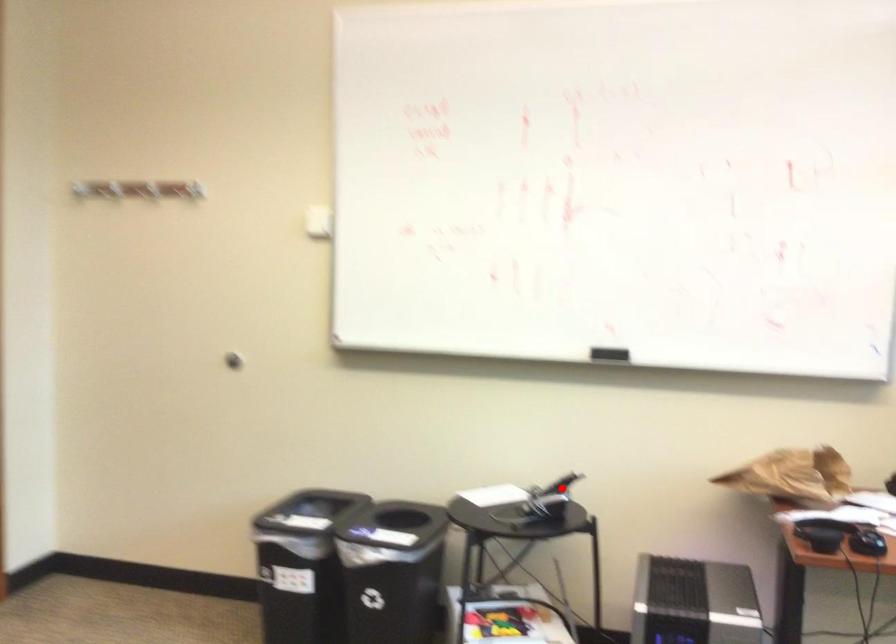
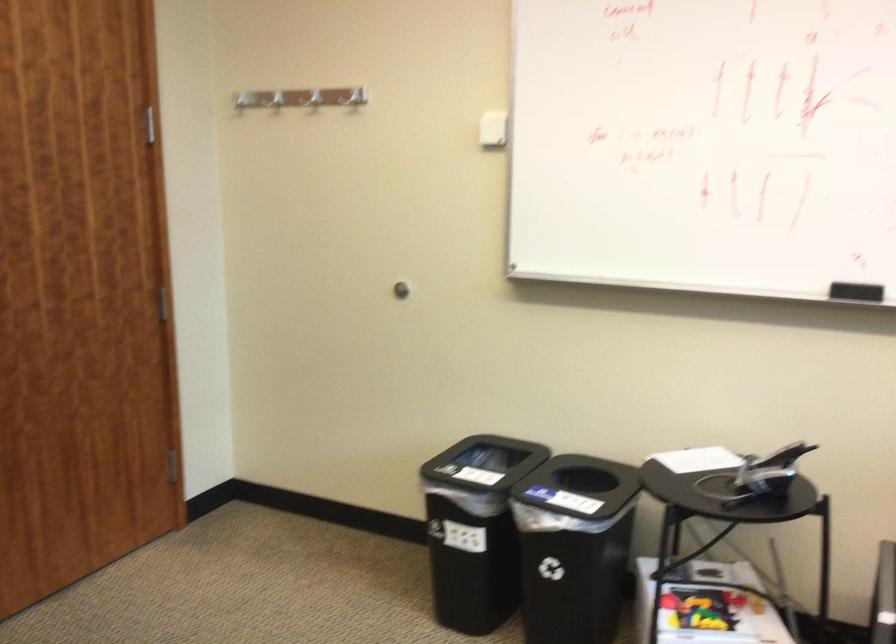
The point at the highlighted location is marked in the first image. Where is the corresponding point in the second image?

(782, 456)